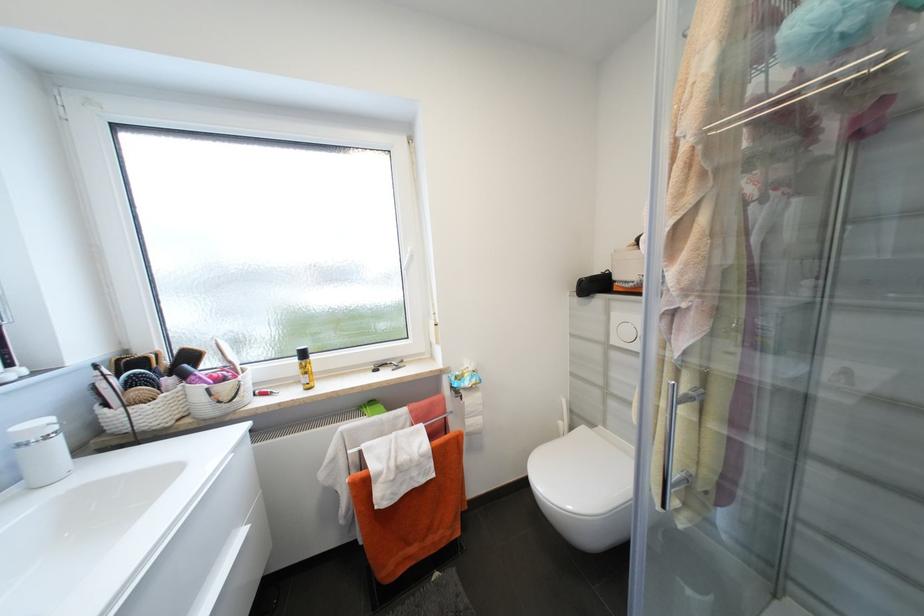
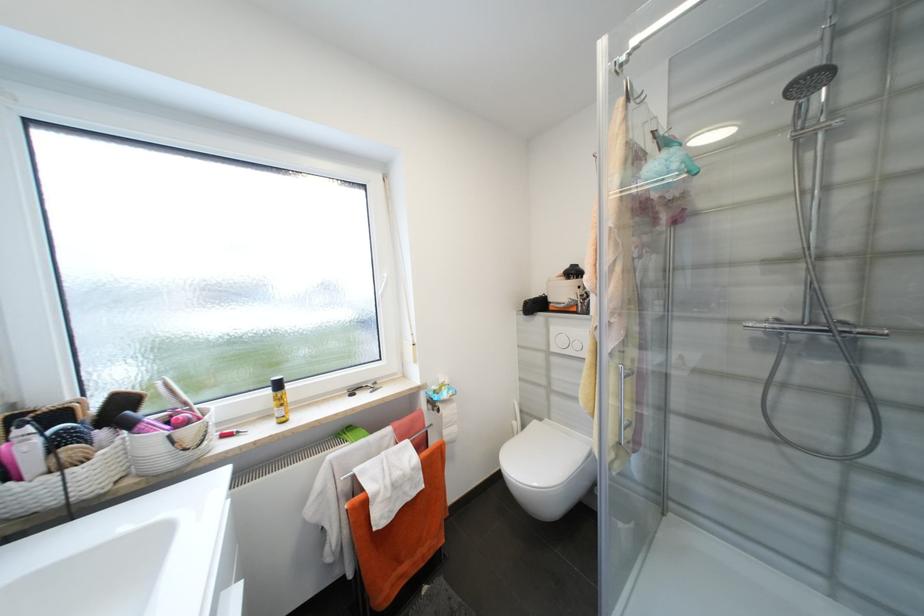
In the second image, find the point that corresponds to (x=310, y=355) in the first image.

(284, 386)